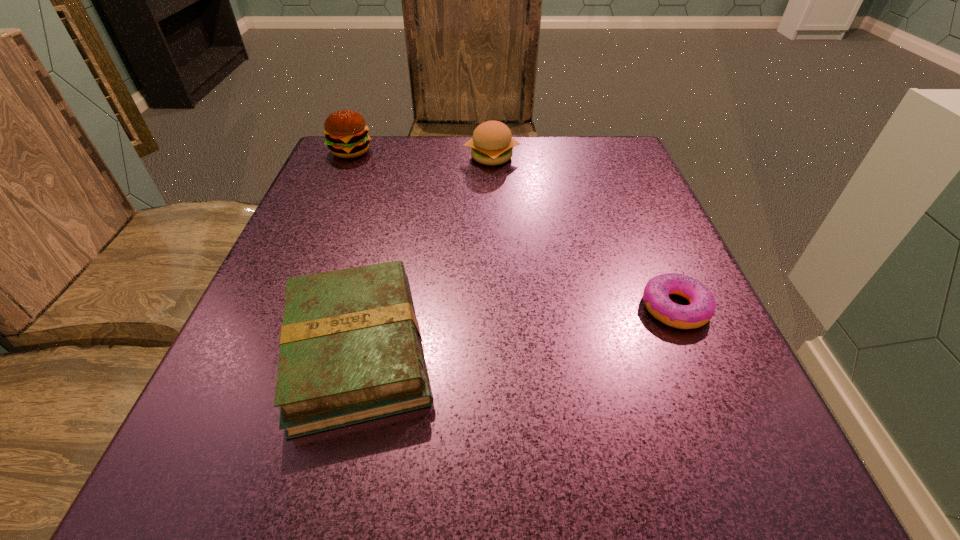
Where is `vacant space at the far right corner of the desktop`? vacant space at the far right corner of the desktop is located at coordinates (587, 183).

Locate an element on the screen. The width and height of the screenshot is (960, 540). free space at the near right corner of the desktop is located at coordinates (696, 505).

In order to click on vacant point located between the rightmost object and the right hamburger in this screenshot , I will do `click(583, 232)`.

Where is `vacant space that's between the left hamburger and the book`? Image resolution: width=960 pixels, height=540 pixels. vacant space that's between the left hamburger and the book is located at coordinates 353,251.

Locate an element on the screen. This screenshot has height=540, width=960. empty space between the rightmost object and the right hamburger is located at coordinates (583, 232).

At what (x,y) coordinates should I click in order to perform the action: click on free space that is in between the left hamburger and the third object from left to right. Please return your answer as a coordinate pair (x, y). The image size is (960, 540). Looking at the image, I should click on (421, 154).

I want to click on vacant area that lies between the left hamburger and the right hamburger, so (x=421, y=154).

The height and width of the screenshot is (540, 960). I want to click on free space that is in between the third tallest object and the third object from left to right, so click(424, 254).

What are the coordinates of `vacant space that is in between the rightmost object and the second object from right to left` in the screenshot? It's located at 583,232.

Locate an element on the screen. Image resolution: width=960 pixels, height=540 pixels. free spot between the book and the second object from right to left is located at coordinates (424, 254).